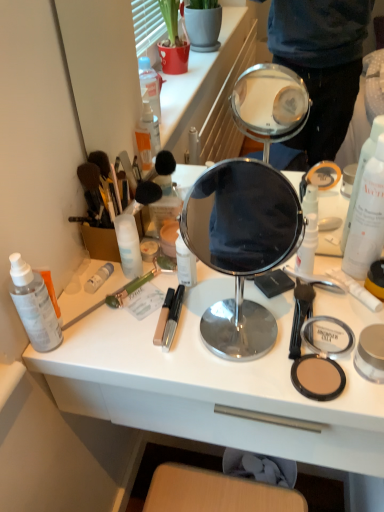
I want to click on free space between matte black compact at lower right and transparent plastic spray bottle at left, which is the 6th toiletry in right-to-left order, so click(180, 362).